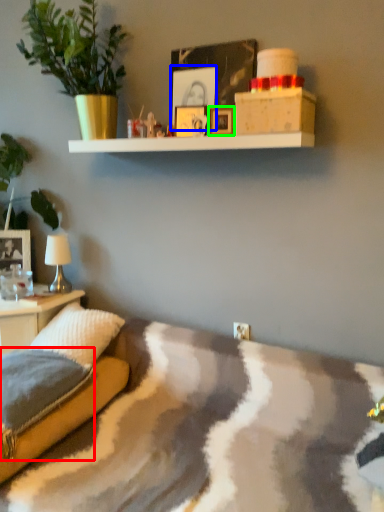
Question: Estimate the real-world distances between objects in this image. Which object is farther from pillow (highlighted by a red box), picture frame (highlighted by a blue box) or picture frame (highlighted by a green box)?

Choices:
 (A) picture frame
 (B) picture frame

Answer: (A)